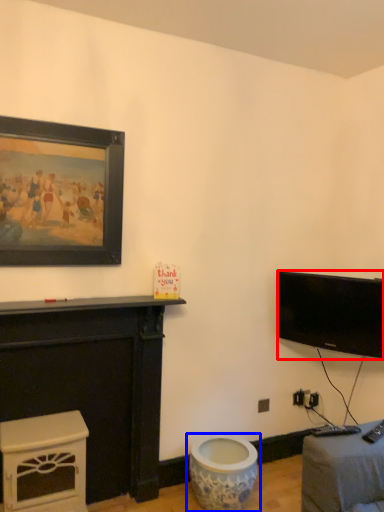
Question: Which of the following is the closest to the observer, television (highlighted by a red box) or toilet (highlighted by a blue box)?

Choices:
 (A) television
 (B) toilet

Answer: (B)